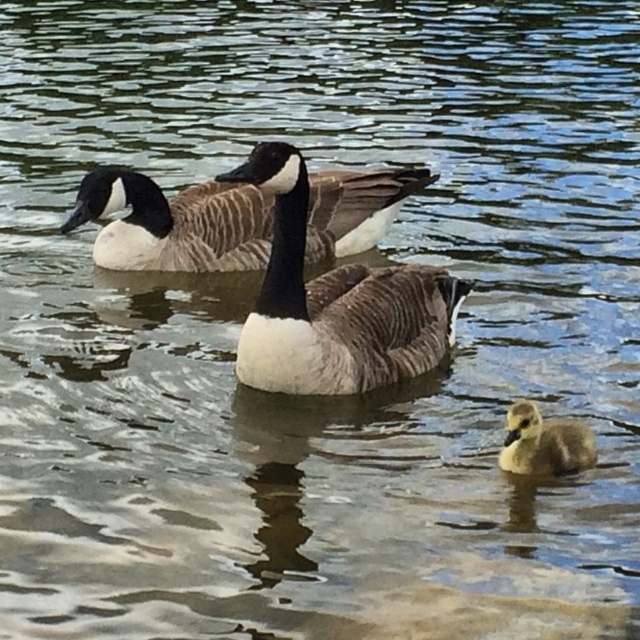
Question: Can you confirm if brown textured goose at center is smaller than soft gray downy duckling at lower right?

Choices:
 (A) no
 (B) yes

Answer: (A)

Question: Where is brown textured goose at center located in relation to soft gray downy duckling at lower right in the image?

Choices:
 (A) right
 (B) left

Answer: (B)

Question: Which object is closer to the camera taking this photo?

Choices:
 (A) brown textured goose at center
 (B) soft gray downy duckling at lower right

Answer: (B)

Question: Does brown speckled goose at upper center have a greater width compared to soft gray downy duckling at lower right?

Choices:
 (A) no
 (B) yes

Answer: (B)

Question: Among these objects, which one is nearest to the camera?

Choices:
 (A) brown speckled goose at upper center
 (B) brown textured goose at center
 (C) soft gray downy duckling at lower right

Answer: (C)

Question: Which object is the closest to the brown speckled goose at upper center?

Choices:
 (A) soft gray downy duckling at lower right
 (B) brown textured goose at center

Answer: (B)